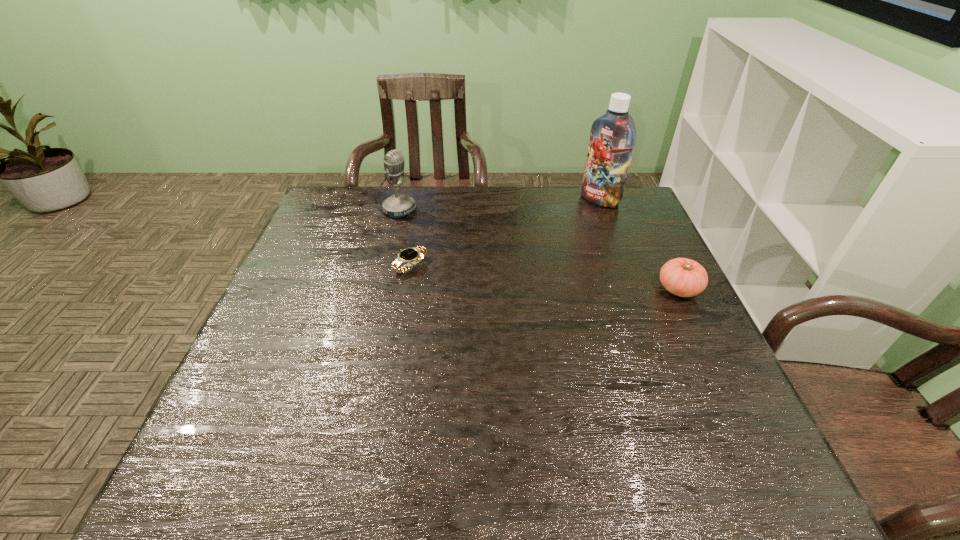
In the image, there is a desktop. Identify the location of vacant space at the near edge. This screenshot has width=960, height=540. (501, 414).

Find the location of `free space at the left edge of the desktop`. free space at the left edge of the desktop is located at coordinates (272, 315).

This screenshot has height=540, width=960. What are the coordinates of `free space at the right edge of the desktop` in the screenshot? It's located at (620, 249).

At what (x,y) coordinates should I click in order to perform the action: click on vacant region at the far left corner. Please return your answer as a coordinate pair (x, y). The height and width of the screenshot is (540, 960). Looking at the image, I should click on [x=332, y=207].

At what (x,y) coordinates should I click in order to perform the action: click on vacant space that's between the second tallest object and the watch. Please return your answer as a coordinate pair (x, y). The image size is (960, 540). Looking at the image, I should click on (405, 238).

The width and height of the screenshot is (960, 540). Identify the location of free space that is in between the microphone and the tomato. (540, 249).

I want to click on unoccupied position between the second shortest object and the watch, so click(544, 277).

Find the location of a particular element. free area in between the tallest object and the shortest object is located at coordinates (505, 233).

Locate an element on the screen. Image resolution: width=960 pixels, height=540 pixels. free area in between the tallest object and the tomato is located at coordinates (639, 244).

Identify the location of unoccupied position between the second tallest object and the second object from right to left. The width and height of the screenshot is (960, 540). (499, 205).